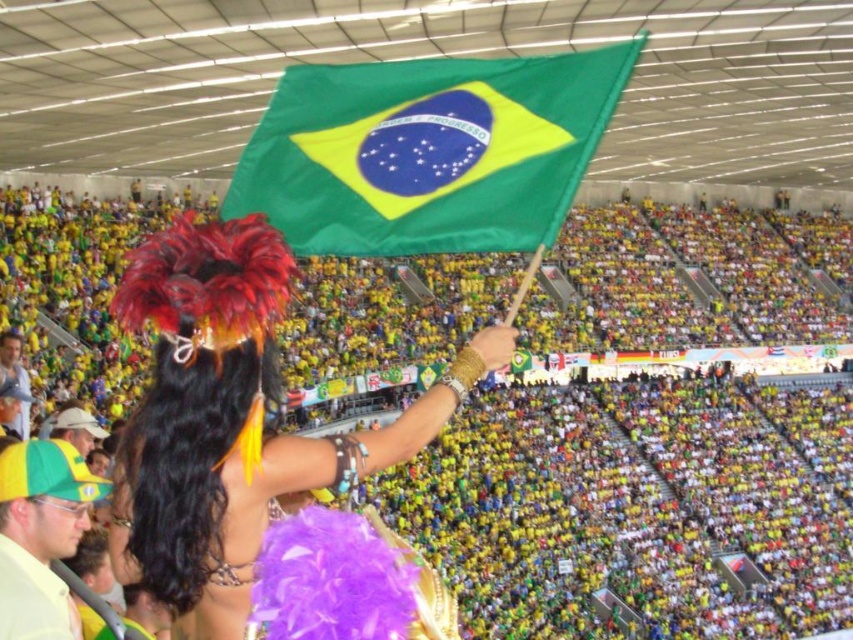
Question: Is feathered headdress at center to the left of yellow fabric cap at upper left from the viewer's perspective?

Choices:
 (A) no
 (B) yes

Answer: (B)

Question: Which of the following is the farthest from the observer?

Choices:
 (A) yellow fabric cap at upper left
 (B) feathered headdress at center
 (C) green fabric flag at center
 (D) smooth skin face at lower left

Answer: (D)

Question: Which of these objects is positioned farthest from the feathered headdress at center?

Choices:
 (A) yellow fabric cap at upper left
 (B) smooth skin face at lower left
 (C) green fabric flag at center

Answer: (B)

Question: Does feathered headdress at center come in front of green fabric flag at center?

Choices:
 (A) no
 (B) yes

Answer: (B)

Question: Which point is farther from the camera taking this photo?

Choices:
 (A) (78, 460)
 (B) (4, 355)

Answer: (B)

Question: Does feathered headdress at center appear on the right side of smooth skin face at lower left?

Choices:
 (A) yes
 (B) no

Answer: (A)